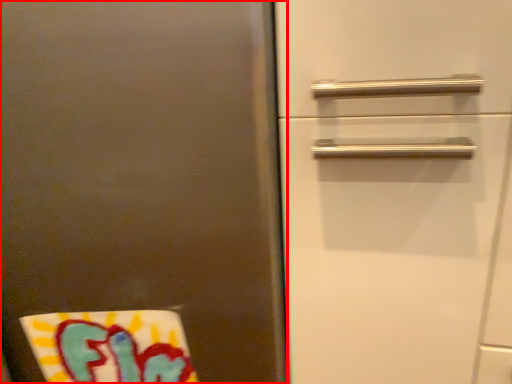
Question: From the image's perspective, what is the correct spatial relationship of door (annotated by the red box) in relation to beach towel?

Choices:
 (A) below
 (B) above

Answer: (B)